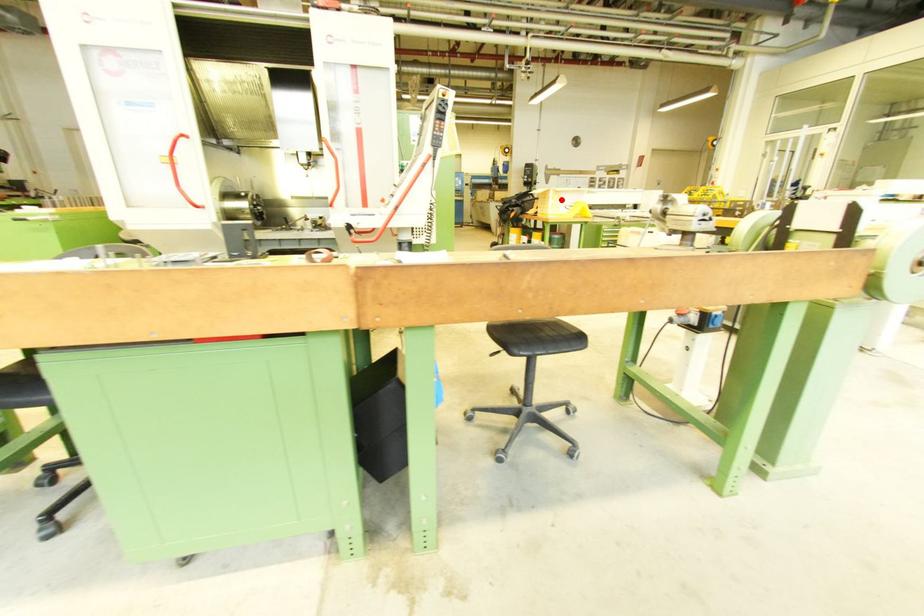
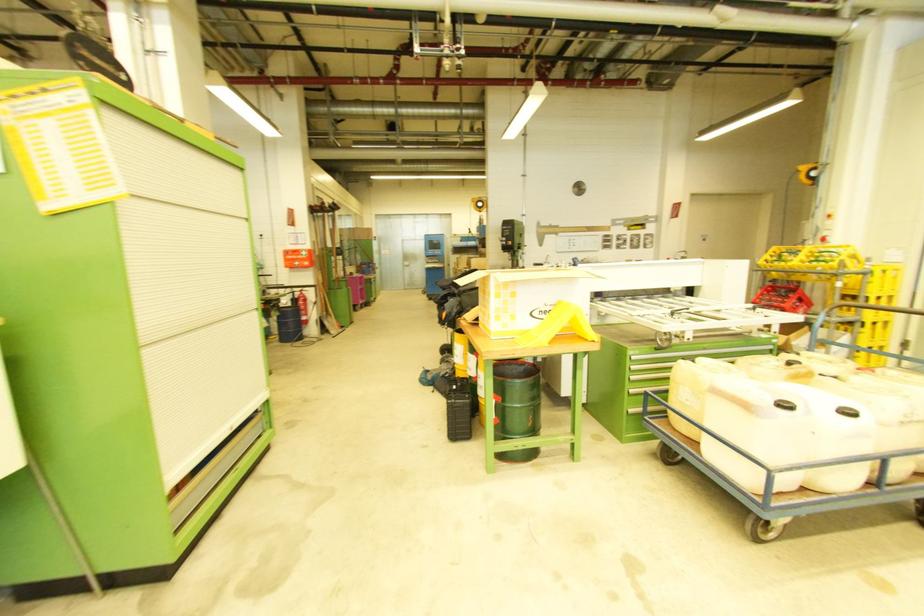
Question: I am providing you with two images of the same scene from different viewpoints. Image1 has a red point marked. In image2, the corresponding 3D location appears at what relative position? Reply with the corresponding letter.

Choices:
 (A) Closer
 (B) Farther

Answer: (B)